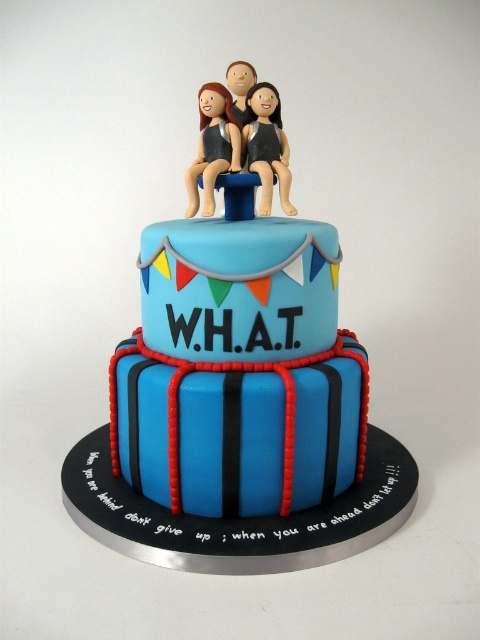
This screenshot has height=640, width=480. Find the location of `matte black figurines at center`. matte black figurines at center is located at coordinates 266,145.

Can you confirm if matte black figurines at center is positioned to the left of smooth plastic figurine at center?

No, matte black figurines at center is not to the left of smooth plastic figurine at center.

Between point (273, 88) and point (230, 88), which one is positioned behind?

The point (230, 88) is more distant.

Identify the location of matte black figurines at center. (266, 145).

Between matte black figurine at top and smooth plastic figurine at center, which one has more height?

Standing taller between the two is matte black figurine at top.

In order to click on matte black figurine at top in this screenshot , I will do `click(266, 145)`.

Is matte black figurines at center wider than matte black figurine at top?

Indeed, matte black figurines at center has a greater width compared to matte black figurine at top.

Can you confirm if matte black figurines at center is positioned above matte black figurine at top?

Actually, matte black figurines at center is below matte black figurine at top.

What do you see at coordinates (266, 145) in the screenshot? The height and width of the screenshot is (640, 480). I see `matte black figurines at center` at bounding box center [266, 145].

The height and width of the screenshot is (640, 480). I want to click on matte black figurines at center, so pos(266,145).